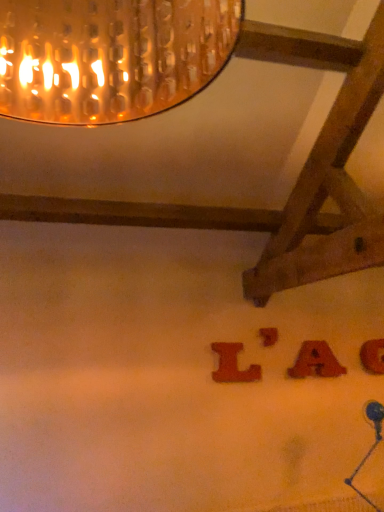
Question: Considering their positions, is matte wooden letter a at lower right, the 2th alphabet when ordered from right to left, located in front of or behind wooden letter l at center, which ranks as the 1th alphabet in left-to-right order?

Choices:
 (A) behind
 (B) front

Answer: (A)

Question: In the image, is matte wooden letter a at lower right, the 2th alphabet when ordered from right to left, on the left side or the right side of wooden letter l at center, the 4th alphabet in the right-to-left sequence?

Choices:
 (A) right
 (B) left

Answer: (A)

Question: Estimate the real-world distances between objects in this image. Which object is closer to the wooden letter at lower right, the 4th alphabet when ordered from left to right?

Choices:
 (A) wooden letter at center, the 3th alphabet positioned from the right
 (B) wooden letter l at center, which ranks as the 1th alphabet in left-to-right order
 (C) matte wooden letter a at lower right, the 2th alphabet when ordered from right to left

Answer: (C)

Question: Which object is the farthest from the wooden letter at center, which appears as the 2th alphabet when viewed from the left?

Choices:
 (A) matte wooden letter a at lower right, the 2th alphabet when ordered from right to left
 (B) wooden letter at lower right, the 1th alphabet from the right
 (C) wooden letter l at center, the 4th alphabet in the right-to-left sequence

Answer: (B)